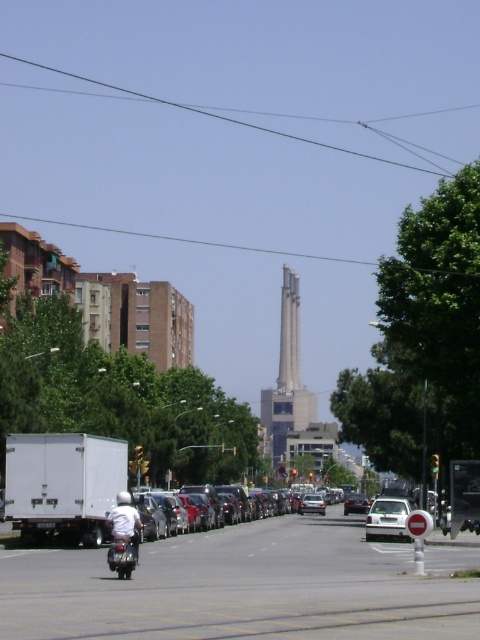
Is point (279, 381) closer to camera compared to point (135, 556)?

No, it is behind (135, 556).

In order to click on concrete tower at center in this screenshot , I will do `click(287, 378)`.

Does clear wire at upper center have a greater height compared to shiny chrome motorcycle at center?

Indeed, clear wire at upper center has a greater height compared to shiny chrome motorcycle at center.

In the scene shown: Does clear wire at upper center appear on the right side of shiny chrome motorcycle at center?

No, clear wire at upper center is not to the right of shiny chrome motorcycle at center.

Find the location of a particular element. The width and height of the screenshot is (480, 640). clear wire at upper center is located at coordinates (223, 116).

Locate an element on the screen. clear wire at upper center is located at coordinates (223, 116).

Can you confirm if clear wire at upper center is wider than shiny silver sedan at center?

Indeed, clear wire at upper center has a greater width compared to shiny silver sedan at center.

Is clear wire at upper center positioned before shiny silver sedan at center?

No, clear wire at upper center is further to the viewer.

Image resolution: width=480 pixels, height=640 pixels. What do you see at coordinates (223, 116) in the screenshot?
I see `clear wire at upper center` at bounding box center [223, 116].

Find the location of `clear wire at upper center`. clear wire at upper center is located at coordinates (223, 116).